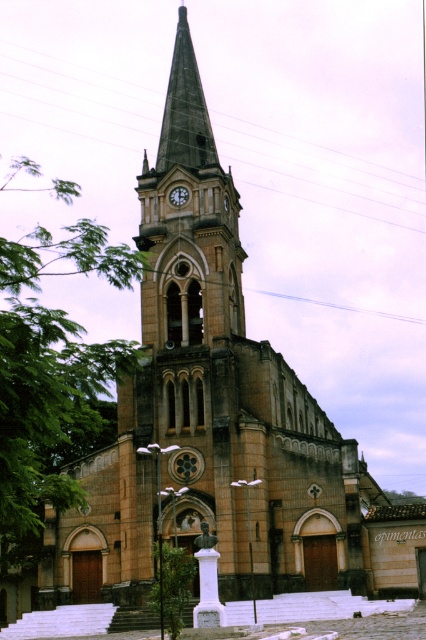
You are a maintenance worker who needs to reach both the green leafy tree at left and the matte stone clock at center. You have a ladder that is 30 meters long. Can you use this ladder to bridge the gap between them?

The distance between the green leafy tree at left and the matte stone clock at center is 27.52 meters. Since the ladder is 30 meters long, which is longer than the gap, you can use the ladder to bridge the gap between them.

You are standing at the base of the church and want to take a photo of both the green leafy tree at left and the matte stone clock at center in the same frame. Which object should you position closer to the camera to ensure both are fully visible?

You should position the green leafy tree at left closer to the camera because it is taller than the matte stone clock at center, allowing both to fit within the frame without cropping either.

You are a photographer planning to take a wide shot of the church. You need to ensure both the green leafy tree at left and the matte stone clock at center are fully visible in the frame. Based on their widths, which object will require more horizontal space in the photo?

The green leafy tree at left requires more horizontal space in the photo because its width surpasses that of the matte stone clock at center.